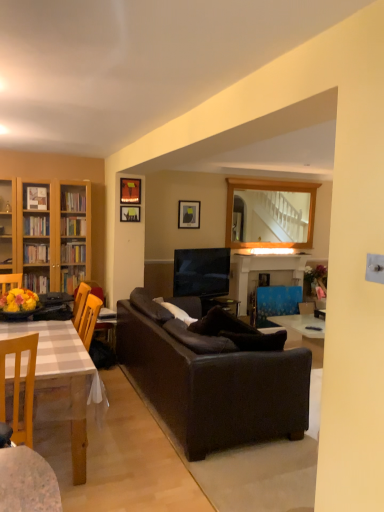
Find the location of a particular element. The height and width of the screenshot is (512, 384). vacant point above blue fabric swivel chair at center (from a real-world perspective) is located at coordinates (278, 281).